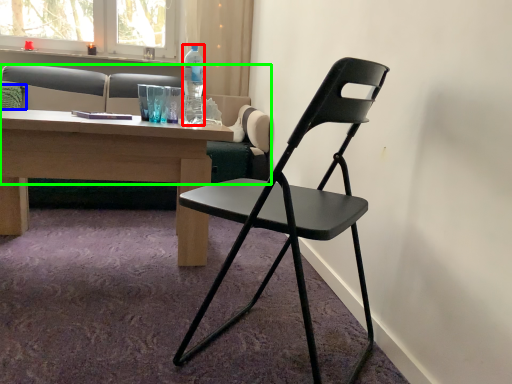
Question: Which object is positioned farthest from bottle (highlighted by a red box)? Select from pillow (highlighted by a blue box) and studio couch (highlighted by a green box).

Choices:
 (A) pillow
 (B) studio couch

Answer: (A)